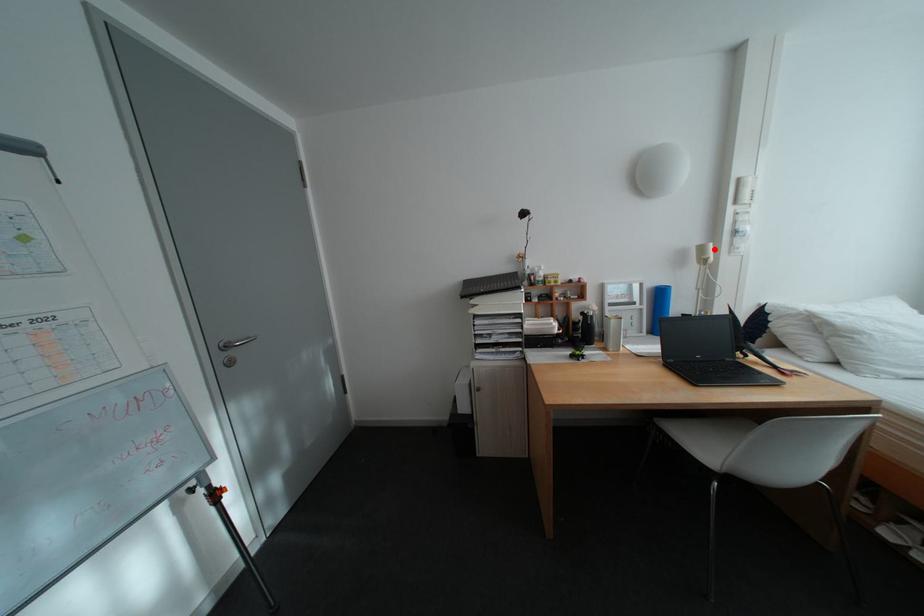
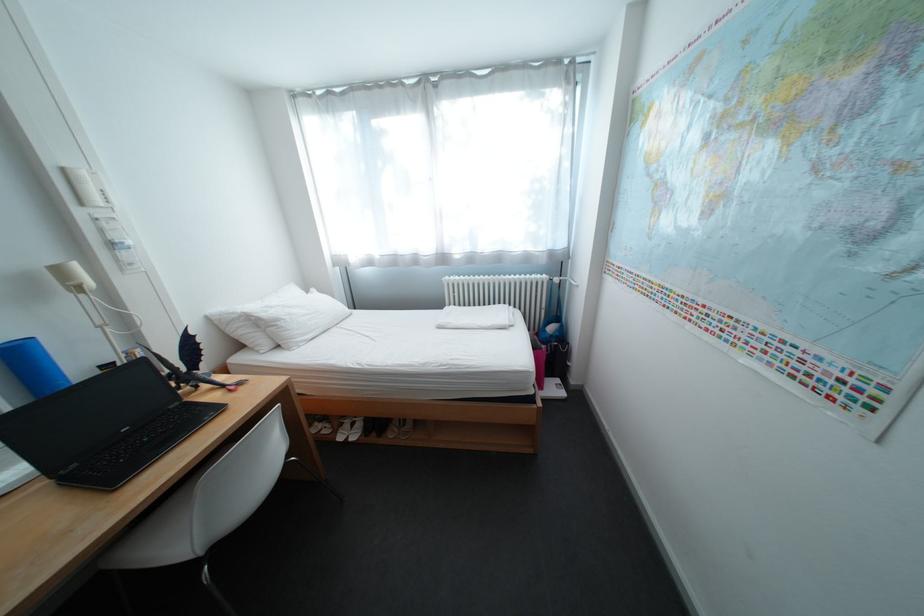
Locate, in the second image, the point that corresponds to the highlighted location in the first image.

(71, 272)